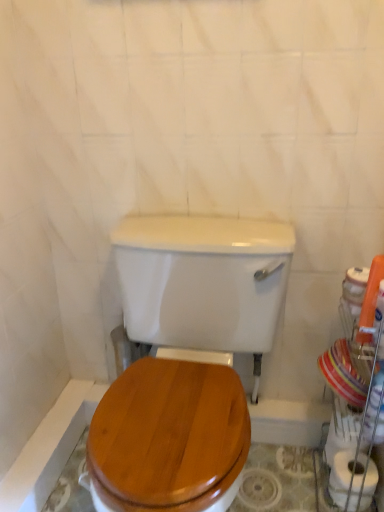
Question: Would you say wooden toilet seat at center is inside or outside white matte toilet paper at lower right?

Choices:
 (A) outside
 (B) inside

Answer: (A)

Question: From a real-world perspective, is wooden toilet seat at center above or below white matte toilet paper at lower right?

Choices:
 (A) above
 (B) below

Answer: (A)

Question: Estimate the real-world distances between objects in this image. Which object is closer to the wooden toilet seat at center?

Choices:
 (A) white glossy porcelain at right
 (B) white matte toilet paper at lower right

Answer: (A)

Question: Based on their relative distances, which object is nearer to the white matte toilet paper at lower right?

Choices:
 (A) wooden toilet seat at center
 (B) white glossy porcelain at right

Answer: (B)